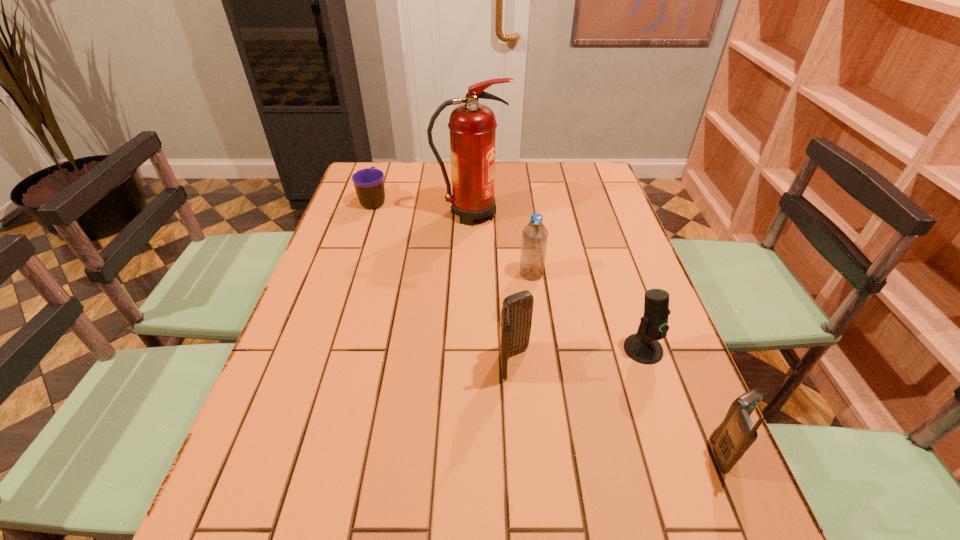
Where is `microphone that is positioned at the right edge`? The width and height of the screenshot is (960, 540). microphone that is positioned at the right edge is located at coordinates (643, 347).

Identify the location of object present at the far left corner. (369, 183).

Locate an element on the screen. The width and height of the screenshot is (960, 540). object that is at the near right corner is located at coordinates (732, 438).

What are the coordinates of `vacant space at the far edge of the desktop` in the screenshot? It's located at (420, 174).

At what (x,y) coordinates should I click in order to perform the action: click on vacant space at the near edge of the desktop. Please return your answer as a coordinate pair (x, y). This screenshot has height=540, width=960. Looking at the image, I should click on (583, 483).

Locate an element on the screen. The width and height of the screenshot is (960, 540). blank area at the left edge is located at coordinates (338, 382).

Identify the location of vacant space at the right edge of the desktop. (586, 225).

The height and width of the screenshot is (540, 960). What are the coordinates of `vacant space at the far right corner of the desktop` in the screenshot? It's located at (607, 184).

Identify the location of vacant space at the near right corner of the desktop. (672, 461).

Find the location of a particular element. This screenshot has width=960, height=540. vacant area that lies between the fire extinguisher and the taller cellular telephone is located at coordinates (492, 288).